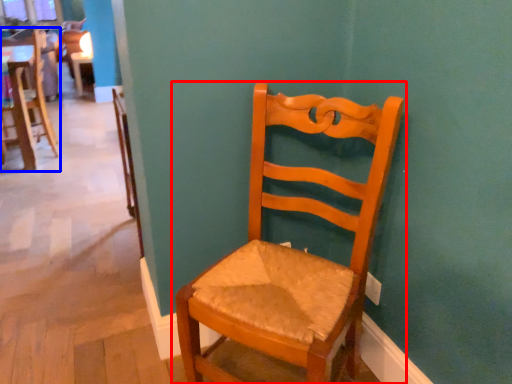
Question: Which object appears closest to the camera in this image, chair (highlighted by a red box) or chair (highlighted by a blue box)?

Choices:
 (A) chair
 (B) chair

Answer: (A)